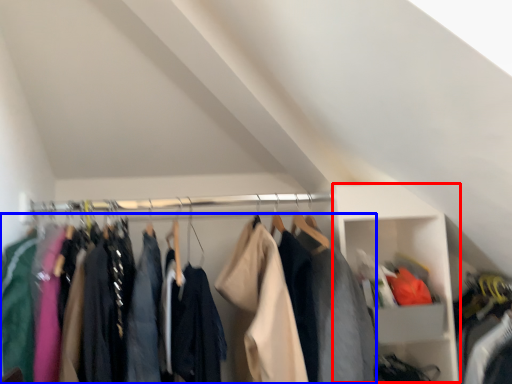
Question: Which object is further to the camera taking this photo, cabinet (highlighted by a red box) or clothing (highlighted by a blue box)?

Choices:
 (A) cabinet
 (B) clothing

Answer: (A)